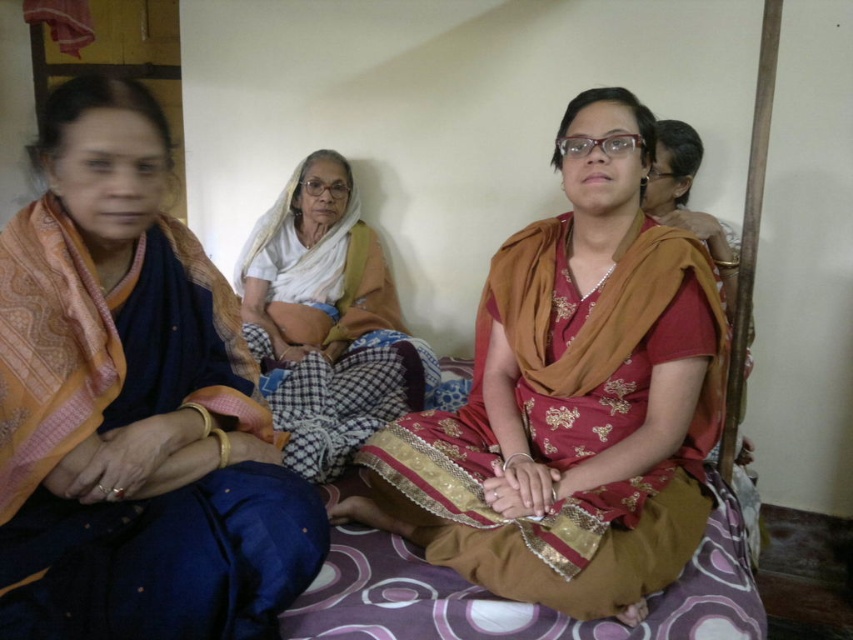
Question: Which object is closer to the camera taking this photo?

Choices:
 (A) white cotton saree at center
 (B) matte brown sari at center
 (C) blue silk saree at left

Answer: (C)

Question: Where is blue silk saree at left located in relation to matte brown sari at center in the image?

Choices:
 (A) left
 (B) right

Answer: (A)

Question: Is blue silk saree at left positioned before matte brown sari at center?

Choices:
 (A) yes
 (B) no

Answer: (A)

Question: Which object is closer to the camera taking this photo?

Choices:
 (A) white cotton saree at center
 (B) matte brown sari at center

Answer: (B)

Question: Which point appears farthest from the camera in this image?

Choices:
 (A) (322, 371)
 (B) (67, 173)
 (C) (692, 362)

Answer: (A)

Question: Is matte brown sari at center in front of white cotton saree at center?

Choices:
 (A) no
 (B) yes

Answer: (B)